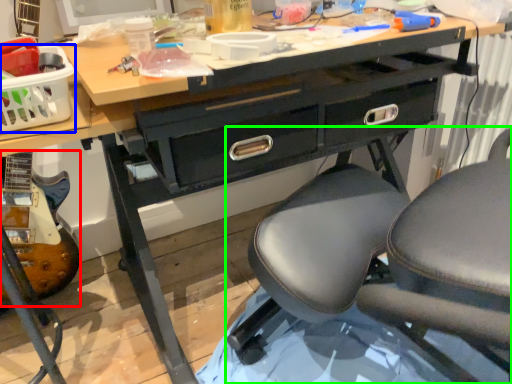
Question: Estimate the real-world distances between objects in this image. Which object is farther from equipment (highlighted by a red box), basket (highlighted by a blue box) or chair (highlighted by a green box)?

Choices:
 (A) basket
 (B) chair

Answer: (B)